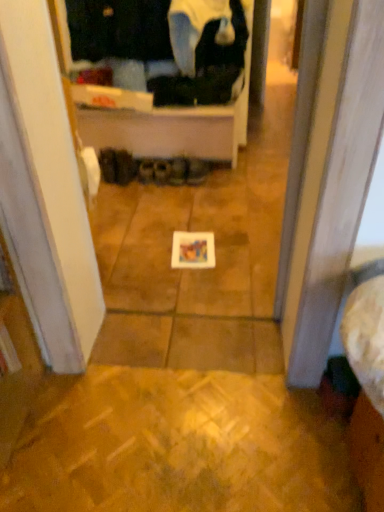
Identify the location of vacant space to the right of matte black shoes at center, the 5th footwear when ordered from left to right. (218, 182).